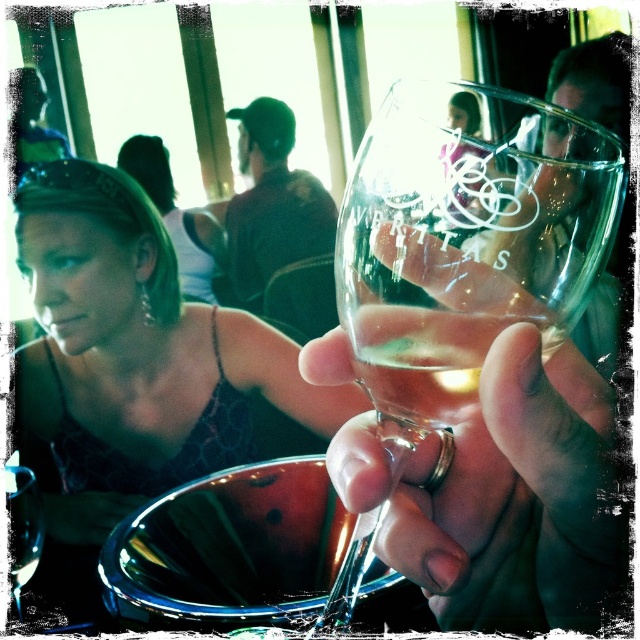
Question: Which object is positioned closest to the matte black dress at center?

Choices:
 (A) green hair at center
 (B) transparent glass wine glass at center

Answer: (A)

Question: Which of the following is the closest to the observer?

Choices:
 (A) clear glass wine glass at center
 (B) transparent glass wine glass at center

Answer: (B)

Question: Can you confirm if transparent glass wine glass at center is positioned to the right of matte black dress at center?

Choices:
 (A) no
 (B) yes

Answer: (B)

Question: Is matte black dress at center positioned before clear glass wine glass at center?

Choices:
 (A) no
 (B) yes

Answer: (A)

Question: In this image, where is transparent glass wine glass at center located relative to matte black dress at center?

Choices:
 (A) above
 (B) below

Answer: (A)

Question: Estimate the real-world distances between objects in this image. Which object is farther from the green hair at center?

Choices:
 (A) clear glass wine glass at center
 (B) matte black dress at center
 (C) transparent glass wine glass at center

Answer: (C)